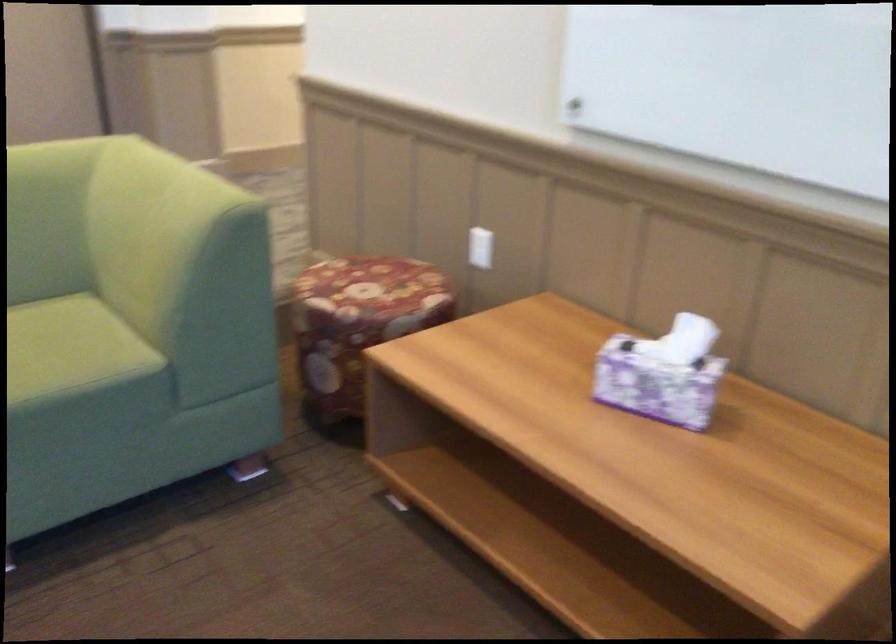
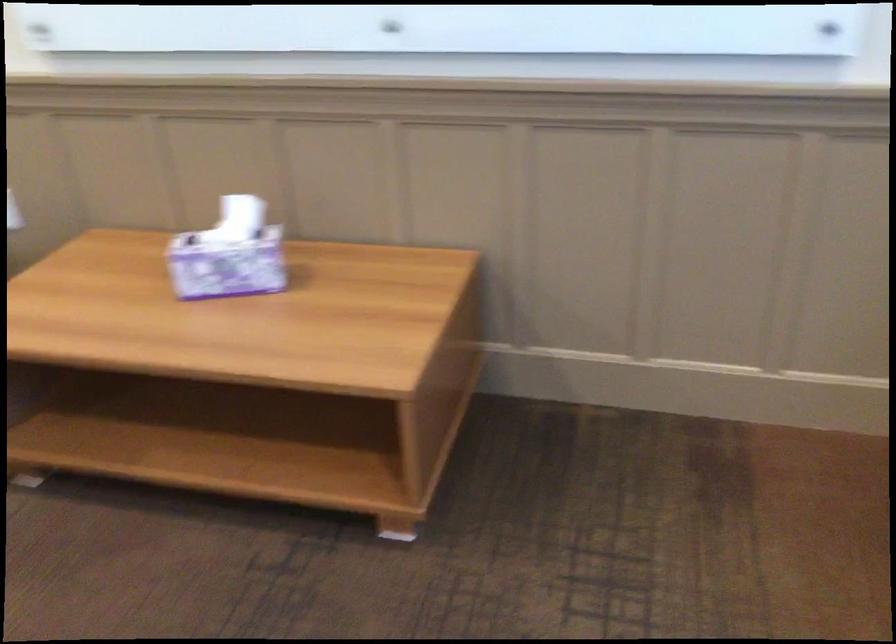
The point at (687, 335) is marked in the first image. Where is the corresponding point in the second image?

(239, 218)